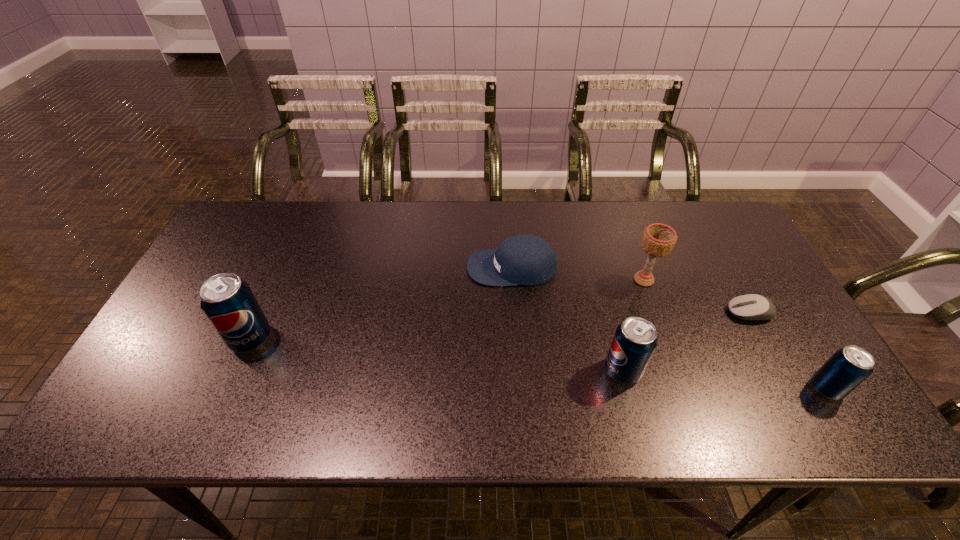
Where is `the leftmost object`? This screenshot has width=960, height=540. the leftmost object is located at coordinates (227, 301).

The height and width of the screenshot is (540, 960). What are the coordinates of `the leftmost soda can` in the screenshot? It's located at (227, 301).

Find the location of a particular element. the second tallest soda can is located at coordinates (635, 340).

Where is `the second soda can from right to left`? This screenshot has height=540, width=960. the second soda can from right to left is located at coordinates (635, 340).

Where is `the rightmost soda can`? This screenshot has width=960, height=540. the rightmost soda can is located at coordinates (848, 367).

Locate an element on the screen. the shortest soda can is located at coordinates (848, 367).

The image size is (960, 540). Find the location of `chalice`. chalice is located at coordinates click(x=658, y=240).

Where is `baseball cap`? baseball cap is located at coordinates (522, 259).

Where is `the second shortest object`? This screenshot has height=540, width=960. the second shortest object is located at coordinates (522, 259).

At what (x,y) coordinates should I click in order to perform the action: click on computer equipment. Please return your answer as a coordinate pair (x, y). The width and height of the screenshot is (960, 540). Looking at the image, I should click on (754, 307).